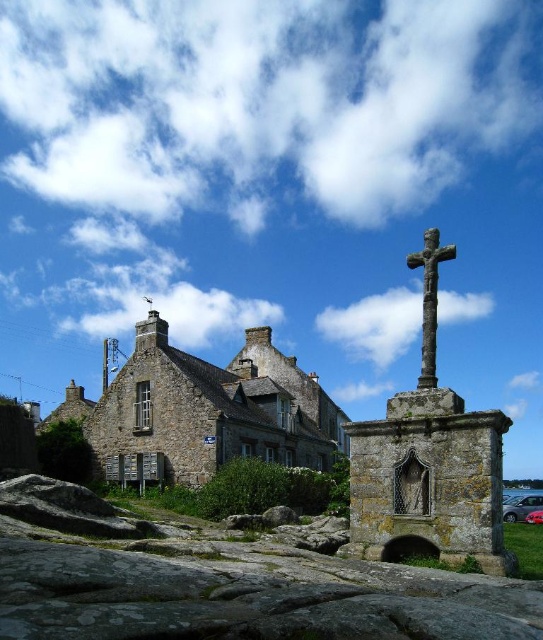
Question: Among these points, which one is farthest from the camera?

Choices:
 (A) (213, 387)
 (B) (449, 257)

Answer: (A)

Question: Can you confirm if stone church at center is bigger than rusty stone cross at center?

Choices:
 (A) yes
 (B) no

Answer: (A)

Question: Observing the image, what is the correct spatial positioning of stone church at center in reference to rusty stone cross at center?

Choices:
 (A) right
 (B) left

Answer: (B)

Question: Can you confirm if stone church at center is positioned to the right of rusty stone cross at center?

Choices:
 (A) yes
 (B) no

Answer: (B)